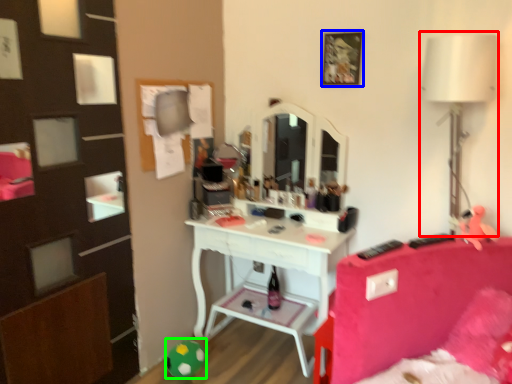
Question: Based on their relative distances, which object is nearer to table lamp (highlighted by a red box)? Choose from picture frame (highlighted by a blue box) and toy (highlighted by a green box).

Choices:
 (A) picture frame
 (B) toy

Answer: (A)